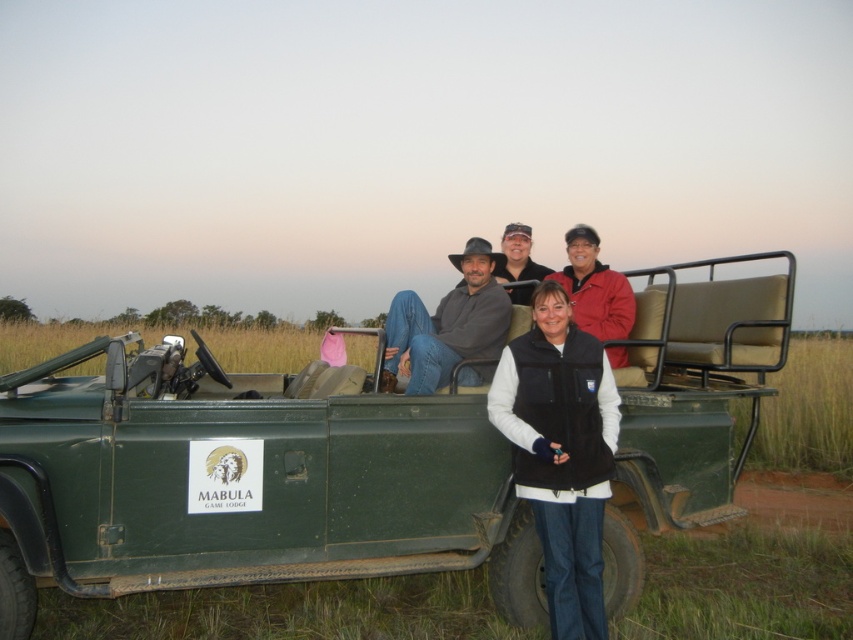
Question: Is denim jeans at center closer to the viewer compared to matte gray hat at center?

Choices:
 (A) yes
 (B) no

Answer: (A)

Question: Which point is farther to the camera?

Choices:
 (A) (587, 392)
 (B) (515, 269)

Answer: (B)

Question: Is denim jeans at center to the left of matte gray hat at center from the viewer's perspective?

Choices:
 (A) yes
 (B) no

Answer: (A)

Question: Which of the following is the farthest from the observer?

Choices:
 (A) matte gray hat at center
 (B) black fleece vest at center

Answer: (A)

Question: Is black fleece vest at center thinner than denim jeans at center?

Choices:
 (A) yes
 (B) no

Answer: (A)

Question: Which is farther from the black fleece vest at center?

Choices:
 (A) denim jeans at center
 (B) matte gray hat at center

Answer: (B)